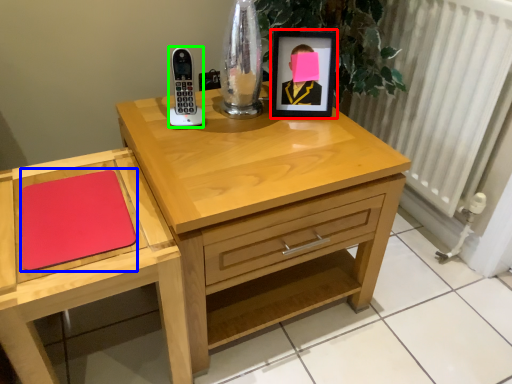
Question: Estimate the real-world distances between objects in this image. Which object is closer to picture frame (highlighted by a red box), notepad (highlighted by a blue box) or phone (highlighted by a green box)?

Choices:
 (A) notepad
 (B) phone

Answer: (B)